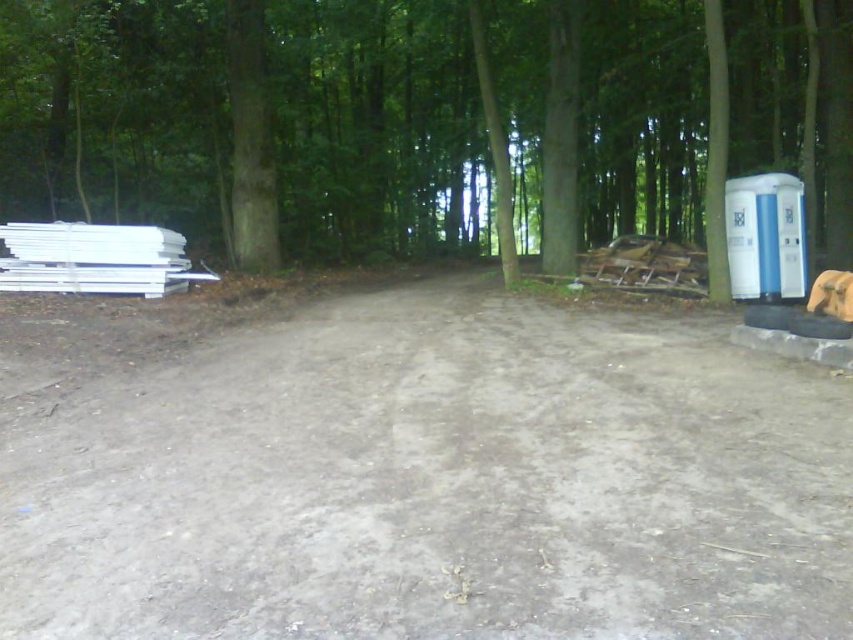
Is gray dirt track at center above white plastic water cooler at right?

Incorrect, gray dirt track at center is not positioned above white plastic water cooler at right.

Looking at this image, is gray dirt track at center to the left of white plastic water cooler at right from the viewer's perspective?

Indeed, gray dirt track at center is positioned on the left side of white plastic water cooler at right.

Between point (349, 490) and point (735, 211), which one is positioned in front?

Point (349, 490) is in front.

This screenshot has height=640, width=853. Identify the location of gray dirt track at center. (422, 477).

Is green smooth tree at left bigger than white plastic water cooler at right?

No, green smooth tree at left is not bigger than white plastic water cooler at right.

Does point (3, 22) come closer to viewer compared to point (737, 253)?

No, it is behind (737, 253).

Find the location of `green smooth tree at left`. green smooth tree at left is located at coordinates (424, 122).

Is gray dirt track at center thinner than green smooth tree at left?

Incorrect, gray dirt track at center's width is not less than green smooth tree at left's.

Who is more forward, (831, 544) or (242, 116)?

Point (831, 544) is more forward.

Between point (587, 529) and point (206, 13), which one is positioned behind?

Positioned behind is point (206, 13).

The image size is (853, 640). Find the location of `gray dirt track at center`. gray dirt track at center is located at coordinates (422, 477).